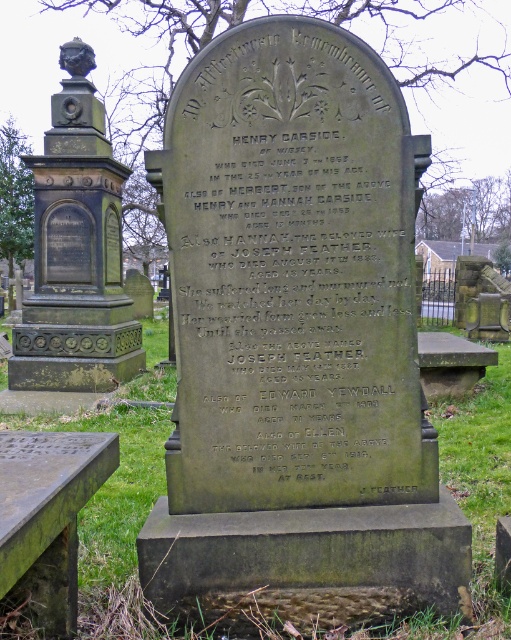
Question: Which object is farther from the camera taking this photo?

Choices:
 (A) dark gray stone inscription at center
 (B) dark gray stone tombstone at center

Answer: (A)

Question: Is the position of dark gray stone inscription at center less distant than that of dark gray stone monument at center?

Choices:
 (A) no
 (B) yes

Answer: (B)

Question: Considering the relative positions of dark gray stone tombstone at center and dark gray stone inscription at center in the image provided, where is dark gray stone tombstone at center located with respect to dark gray stone inscription at center?

Choices:
 (A) below
 (B) above

Answer: (A)

Question: Estimate the real-world distances between objects in this image. Which object is farther from the dark gray stone tombstone at center?

Choices:
 (A) dark gray stone inscription at center
 (B) dark gray stone monument at center

Answer: (B)

Question: Is dark gray stone inscription at center thinner than dark gray stone monument at center?

Choices:
 (A) no
 (B) yes

Answer: (B)

Question: Among these objects, which one is nearest to the camera?

Choices:
 (A) dark gray stone tombstone at center
 (B) dark gray stone inscription at center
 (C) dark gray stone monument at center

Answer: (A)